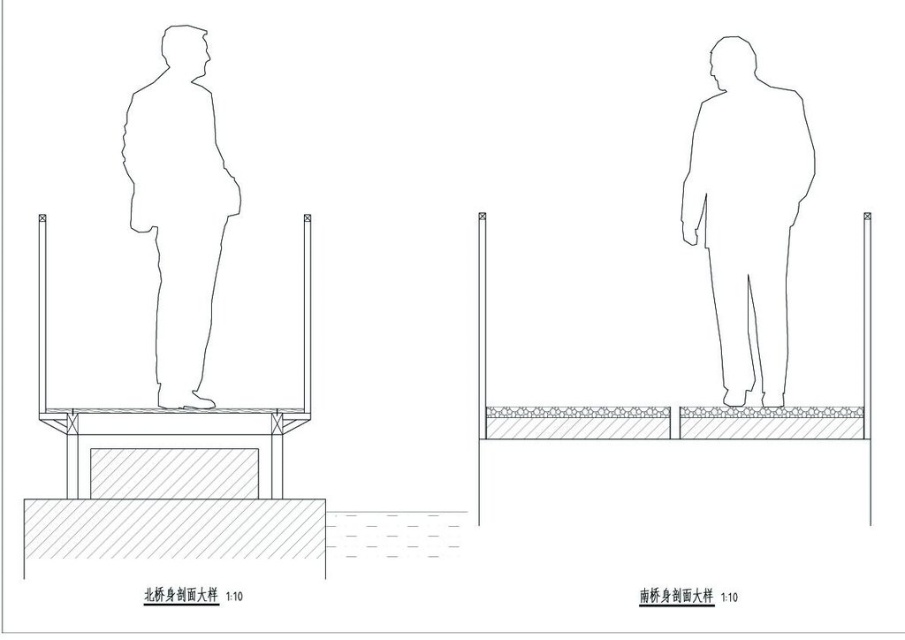
Question: Which of the following is the farthest from the observer?

Choices:
 (A) (164, 141)
 (B) (732, 269)

Answer: (B)

Question: Does white matte figure at center have a smaller size compared to white paper man at center?

Choices:
 (A) no
 (B) yes

Answer: (A)

Question: Among these points, which one is farthest from the camera?

Choices:
 (A) (181, 88)
 (B) (783, 237)

Answer: (B)

Question: Does white matte figure at center appear over white paper man at center?

Choices:
 (A) yes
 (B) no

Answer: (B)

Question: Observing the image, what is the correct spatial positioning of white matte figure at center in reference to white paper man at center?

Choices:
 (A) above
 (B) below

Answer: (B)